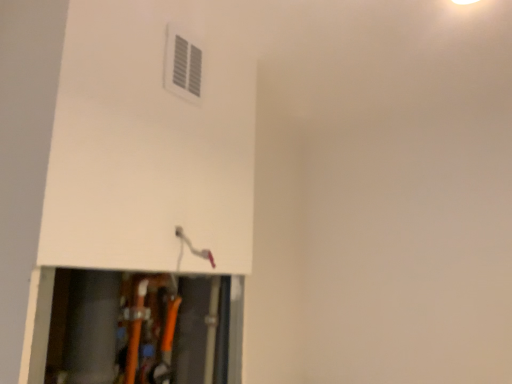
This screenshot has width=512, height=384. Find the location of `white plastic air conditioning at upper center`. white plastic air conditioning at upper center is located at coordinates (183, 64).

The height and width of the screenshot is (384, 512). What do you see at coordinates (183, 64) in the screenshot?
I see `white plastic air conditioning at upper center` at bounding box center [183, 64].

Measure the distance between point (184,75) and camera.

Point (184,75) is 1.04 meters from camera.

Locate an element on the screen. This screenshot has width=512, height=384. white plastic air conditioning at upper center is located at coordinates (183, 64).